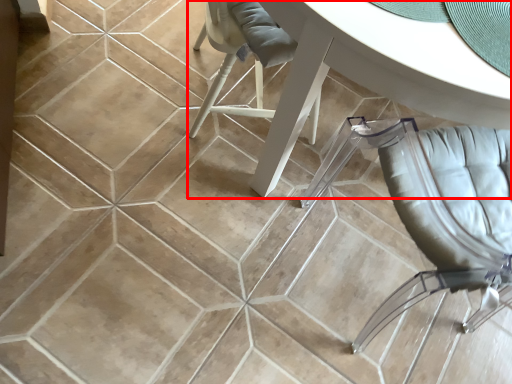
Question: Where is table (annotated by the red box) located in relation to chair in the image?

Choices:
 (A) right
 (B) left

Answer: (B)